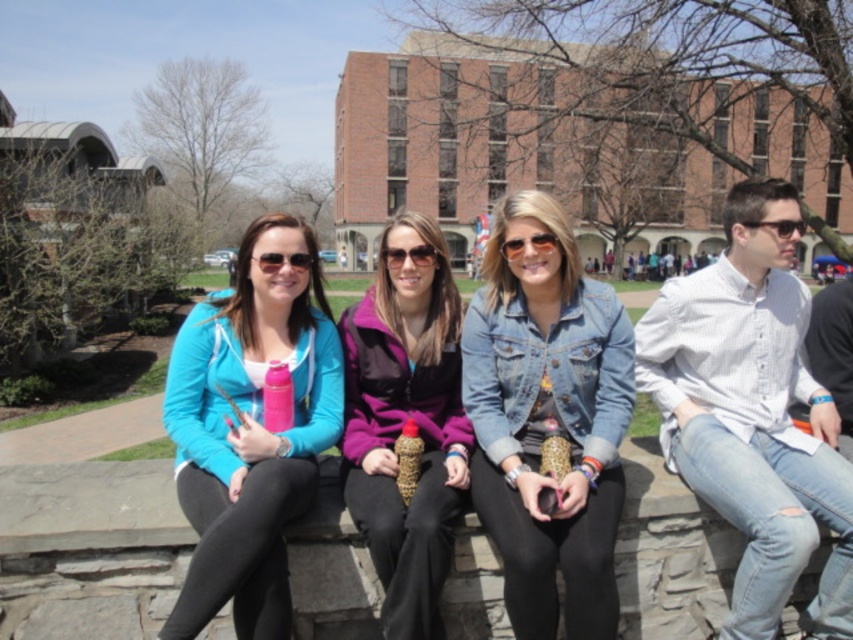
You are a photographer trying to capture a clear photo of the denim jacket at center and the matte purple sunglasses at center. Since you want to focus on the sunglasses, which object should you place closer to the camera to ensure the sunglasses appear larger in the photo?

To make the matte purple sunglasses at center appear larger in the photo, you should place the denim jacket at center closer to the camera because it is much taller than the matte purple sunglasses at center. This way, the taller denim jacket at center will block less of the sunglasses, allowing them to be more prominently visible.